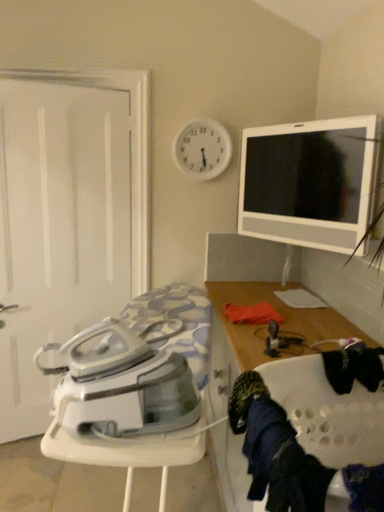
Question: Is white glossy tv at upper right in front of or behind white glossy ironing board at lower left in the image?

Choices:
 (A) front
 (B) behind

Answer: (B)

Question: From the image's perspective, relative to white glossy ironing board at lower left, is white glossy tv at upper right above or below?

Choices:
 (A) above
 (B) below

Answer: (A)

Question: Which object is the farthest from the white glossy tv at upper right?

Choices:
 (A) wooden cabinet at right
 (B) dark blue fabric at lower right
 (C) white glossy ironing board at lower left
 (D) white matte door at left
 (E) white plastic clock at upper center

Answer: (B)

Question: Which is farther from the white glossy ironing board at lower left?

Choices:
 (A) wooden cabinet at right
 (B) dark blue fabric at lower right
 (C) white matte door at left
 (D) white glossy tv at upper right
 (E) white plastic clock at upper center

Answer: (E)